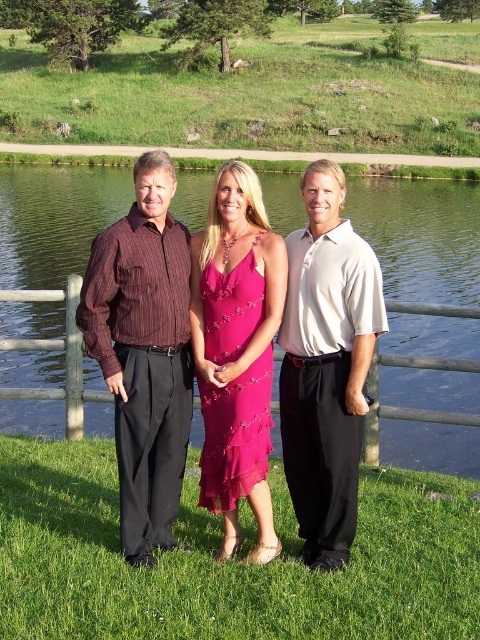
Question: Is green grass at lower center to the left of matte black dress at center from the viewer's perspective?

Choices:
 (A) no
 (B) yes

Answer: (A)

Question: Estimate the real-world distances between objects in this image. Which object is farther from the white cotton polo shirt at center?

Choices:
 (A) pink satin dress at center
 (B) green grass at lower center
 (C) matte black dress at center

Answer: (B)

Question: Which point is farther from the camera taking this photo?

Choices:
 (A) (16, 481)
 (B) (312, 304)

Answer: (A)

Question: Considering the relative positions of green grass at lower center and white cotton polo shirt at center in the image provided, where is green grass at lower center located with respect to white cotton polo shirt at center?

Choices:
 (A) left
 (B) right

Answer: (A)

Question: Is matte black dress at center closer to the viewer compared to striped cotton shirt at center?

Choices:
 (A) no
 (B) yes

Answer: (B)

Question: Which point appears closest to the camera in this image?

Choices:
 (A) (309, 337)
 (B) (94, 292)
 (C) (107, 285)

Answer: (C)